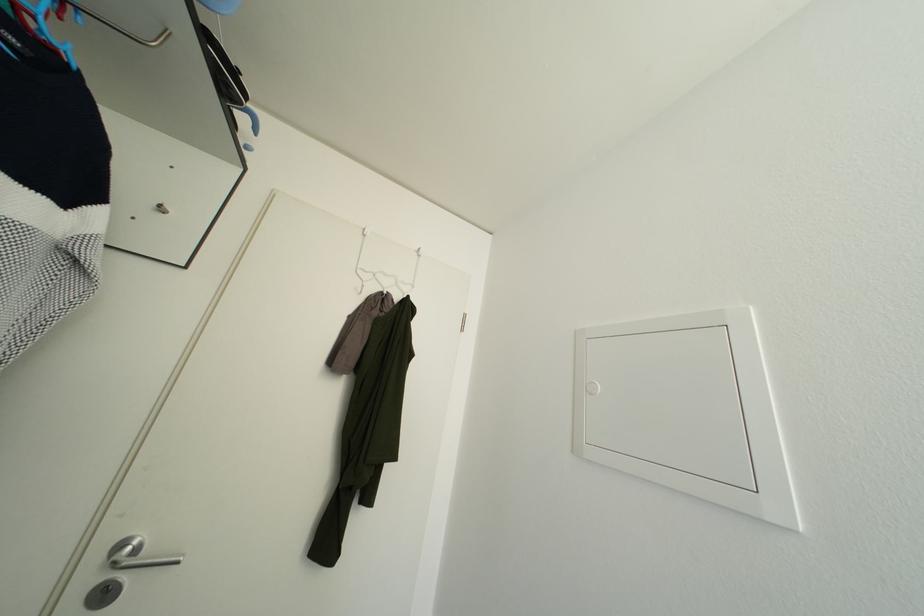
In order to click on white panel latch in this screenshot , I will do `click(685, 408)`.